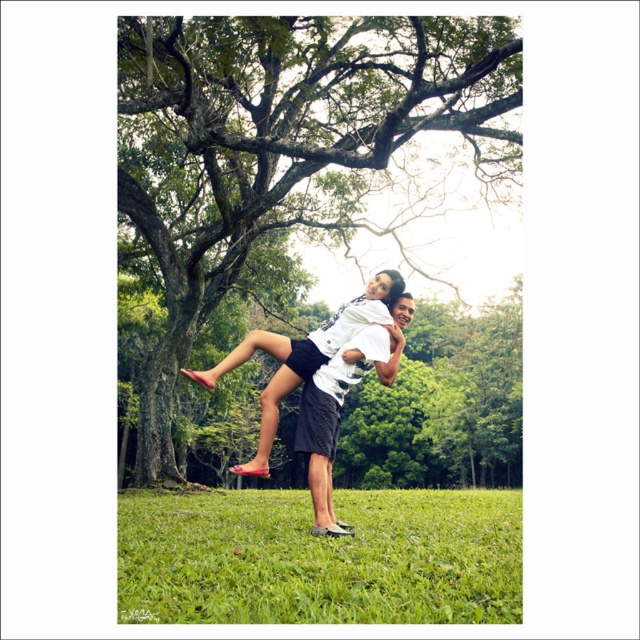
Question: Which of the following is the farthest from the observer?

Choices:
 (A) (493, 496)
 (B) (156, 340)
 (C) (291, 388)
 (D) (324, 436)

Answer: (B)

Question: Does green leafy tree at center have a larger size compared to matte white shirt at center?

Choices:
 (A) no
 (B) yes

Answer: (B)

Question: Is matte white shirt at center to the left of white matte shorts at center from the viewer's perspective?

Choices:
 (A) yes
 (B) no

Answer: (A)

Question: Based on their relative distances, which object is nearer to the green grass at lower center?

Choices:
 (A) green leafy tree at center
 (B) white matte shorts at center

Answer: (B)

Question: Does green leafy tree at center have a larger size compared to white matte shorts at center?

Choices:
 (A) yes
 (B) no

Answer: (A)

Question: Which of the following is the farthest from the observer?

Choices:
 (A) click(x=330, y=532)
 (B) click(x=378, y=282)
 (C) click(x=419, y=588)
 (D) click(x=186, y=284)

Answer: (D)